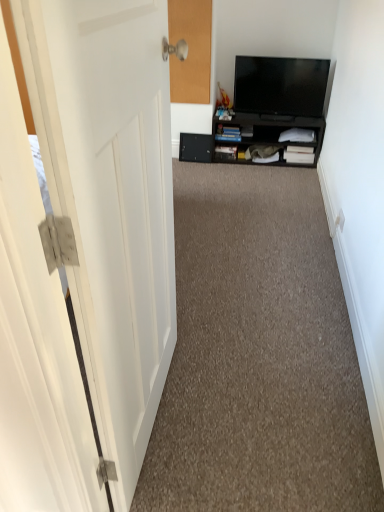
Question: Considering the relative positions of black glossy tv at upper right and black matte drawer at center in the image provided, is black glossy tv at upper right to the right of black matte drawer at center from the viewer's perspective?

Choices:
 (A) no
 (B) yes

Answer: (B)

Question: Considering the relative positions of black glossy tv at upper right and black matte drawer at center in the image provided, is black glossy tv at upper right to the left of black matte drawer at center from the viewer's perspective?

Choices:
 (A) yes
 (B) no

Answer: (B)

Question: Are black glossy tv at upper right and black matte drawer at center beside each other?

Choices:
 (A) no
 (B) yes

Answer: (A)

Question: From the image's perspective, does black glossy tv at upper right appear higher than black matte drawer at center?

Choices:
 (A) yes
 (B) no

Answer: (A)

Question: Can you confirm if black glossy tv at upper right is thinner than black matte drawer at center?

Choices:
 (A) yes
 (B) no

Answer: (B)

Question: From the image's perspective, is black matte drawer at center positioned above or below white matte door at left?

Choices:
 (A) below
 (B) above

Answer: (B)

Question: Is black matte drawer at center bigger or smaller than white matte door at left?

Choices:
 (A) small
 (B) big

Answer: (A)

Question: Considering the positions of point (201, 160) and point (99, 7), is point (201, 160) closer or farther from the camera than point (99, 7)?

Choices:
 (A) farther
 (B) closer

Answer: (A)

Question: Considering their positions, is black matte drawer at center located in front of or behind white matte door at left?

Choices:
 (A) front
 (B) behind

Answer: (B)

Question: From the image's perspective, relative to carpet at center, is black matte cabinet at center above or below?

Choices:
 (A) below
 (B) above

Answer: (B)

Question: From a real-world perspective, is black matte cabinet at center above or below carpet at center?

Choices:
 (A) below
 (B) above

Answer: (B)

Question: In terms of width, does black matte cabinet at center look wider or thinner when compared to carpet at center?

Choices:
 (A) wide
 (B) thin

Answer: (B)

Question: Would you say black matte cabinet at center is to the left or to the right of carpet at center in the picture?

Choices:
 (A) right
 (B) left

Answer: (A)

Question: From the image's perspective, is black glossy tv at upper right above or below white matte door at left?

Choices:
 (A) below
 (B) above

Answer: (B)

Question: Which is correct: black glossy tv at upper right is inside white matte door at left, or outside of it?

Choices:
 (A) outside
 (B) inside

Answer: (A)